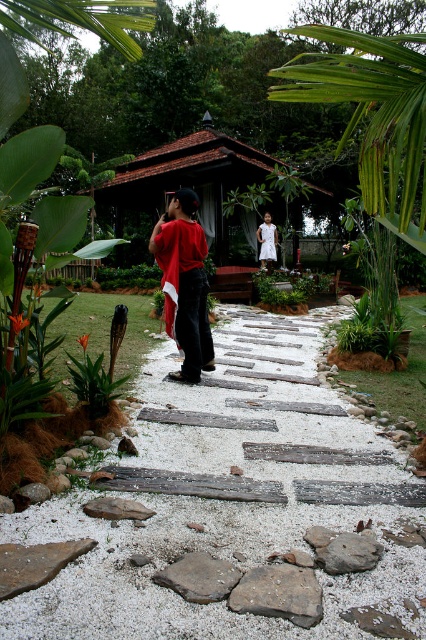
Question: Can you confirm if white gravel at center is positioned to the left of white cotton dress at center?

Choices:
 (A) no
 (B) yes

Answer: (B)

Question: Can you confirm if brown wooden gazebo at center is positioned below green leafy bush at center?

Choices:
 (A) yes
 (B) no

Answer: (B)

Question: Which of the following is the farthest from the observer?

Choices:
 (A) (203, 172)
 (B) (259, 257)

Answer: (A)

Question: Does gray rough stone at center appear on the left side of white cotton dress at center?

Choices:
 (A) no
 (B) yes

Answer: (B)

Question: Estimate the real-world distances between objects in this image. Which object is closer to the gray rough stone at center?

Choices:
 (A) white cotton dress at center
 (B) green leafy bush at center

Answer: (B)

Question: Among these points, which one is farthest from the camera?

Choices:
 (A) (267, 570)
 (B) (252, 444)

Answer: (B)